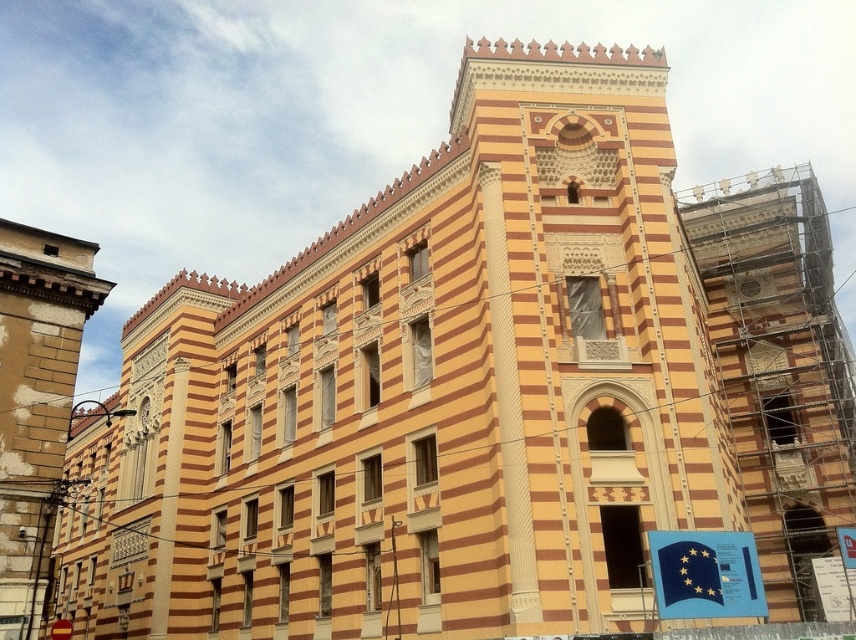
Question: Does scaffolding at right lie behind blue paper flag at lower right?

Choices:
 (A) no
 (B) yes

Answer: (B)

Question: Does blue paper flag at lower right appear under metallic gold clock at upper right?

Choices:
 (A) no
 (B) yes

Answer: (B)

Question: Among these objects, which one is nearest to the camera?

Choices:
 (A) scaffolding at right
 (B) blue paper flag at lower right
 (C) metallic gold clock at upper right

Answer: (B)

Question: Which point is farther from the camera taking this photo?

Choices:
 (A) (756, 280)
 (B) (735, 609)
 (C) (730, 340)

Answer: (A)

Question: Which point is closer to the camera?

Choices:
 (A) (744, 291)
 (B) (746, 257)
 (C) (722, 545)

Answer: (C)

Question: Does scaffolding at right have a smaller size compared to blue paper flag at lower right?

Choices:
 (A) yes
 (B) no

Answer: (B)